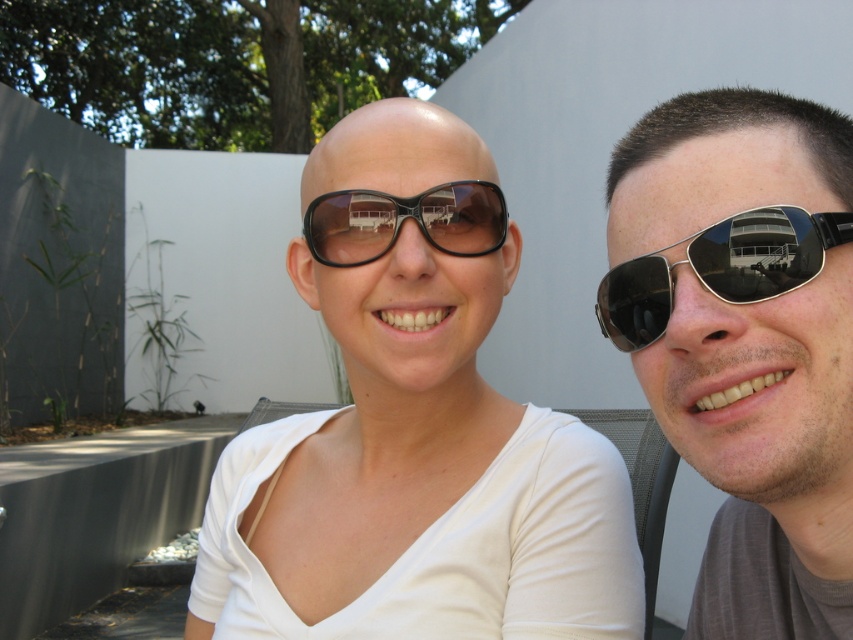
You are a photographer adjusting your camera settings to capture the scene. You notice the matte black sunglasses at center and the metallic aviator sunglasses at right. Which pair of sunglasses is positioned lower in the frame?

The matte black sunglasses at center is positioned lower in the frame than the metallic aviator sunglasses at right.

You are trying to decide which pair of sunglasses to buy. You see two pairs in the image, the matte black sunglasses at center and the black matte sunglasses at center. Which one is bigger?

The matte black sunglasses at center is larger in size than the black matte sunglasses at center.